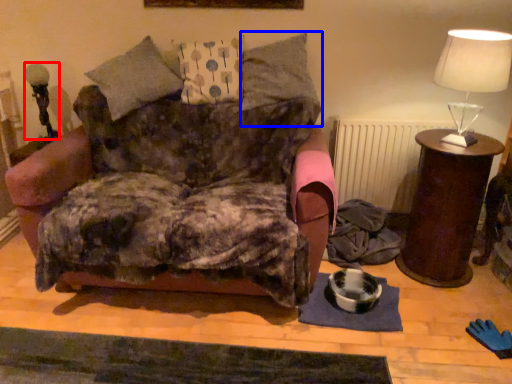
Question: Which point is further to the camera, table lamp (highlighted by a red box) or pillow (highlighted by a blue box)?

Choices:
 (A) table lamp
 (B) pillow

Answer: (A)